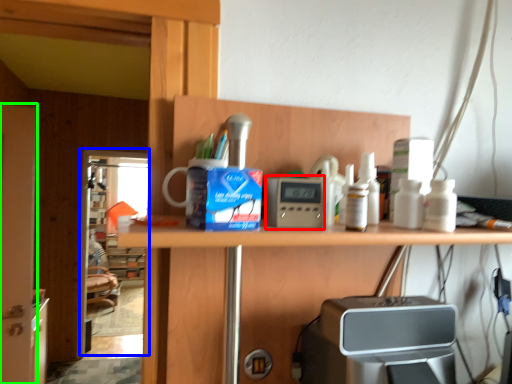
Question: Based on their relative distances, which object is nearer to appliance (highlighted by a red box)? Choose from screen door (highlighted by a blue box) and screen door (highlighted by a green box).

Choices:
 (A) screen door
 (B) screen door

Answer: (B)